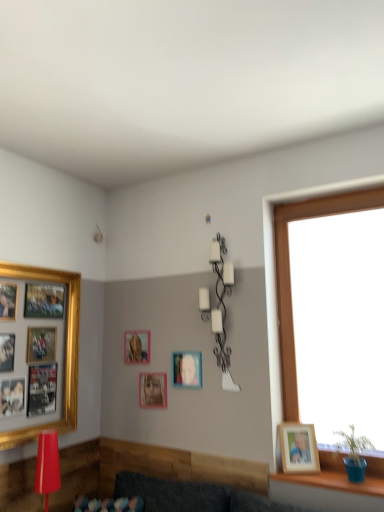
Find the location of a particular element. empty space that is ontop of blue plastic pot at lower right (from a real-world perspective) is located at coordinates (330, 476).